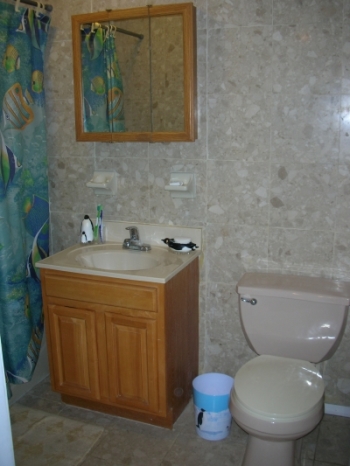
Locate an element on the screen. tile floor is located at coordinates (88, 443).